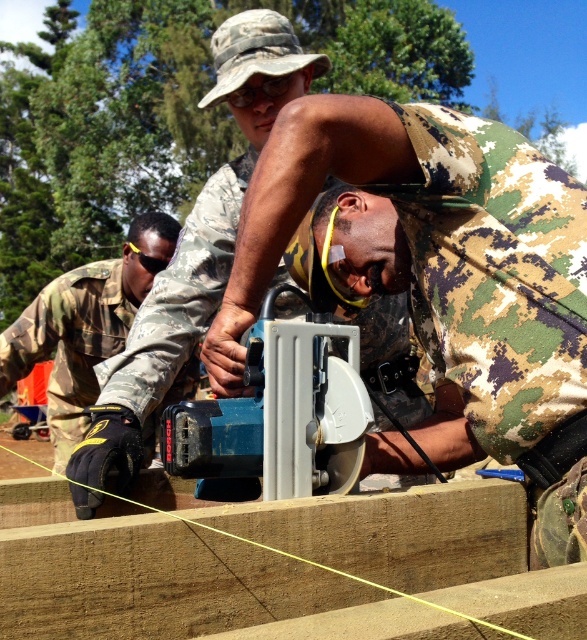
You are a safety inspector standing at the scene. You need to ensure that the brown wood plank at center is at least 2 meters away from the camouflage uniform at left for safety. Is the current distance compliant with the safety requirement?

The distance between the brown wood plank at center and the camouflage uniform at left is 2.22 meters, which exceeds the required 2 meters. Therefore, the current distance is compliant with the safety requirement.

You are a safety inspector checking the workspace. The recommended safe distance between a worker and the workpiece during saw operation is at least 1.5 meters to prevent injury from flying debris. Based on the scene, is the distance between the brown wood plank at center and the camo fabric man at center compliant with safety standards?

The brown wood plank at center is 1.44 meters away from the camo fabric man at center, which is less than the required 1.5 meters. Therefore, the distance does not comply with safety standards.

You are a drone operator trying to locate a specific point in the image. The point is at coordinate (194, 246). Which object is this point located on?

The point at coordinate (194, 246) is on the camo fabric man at center.